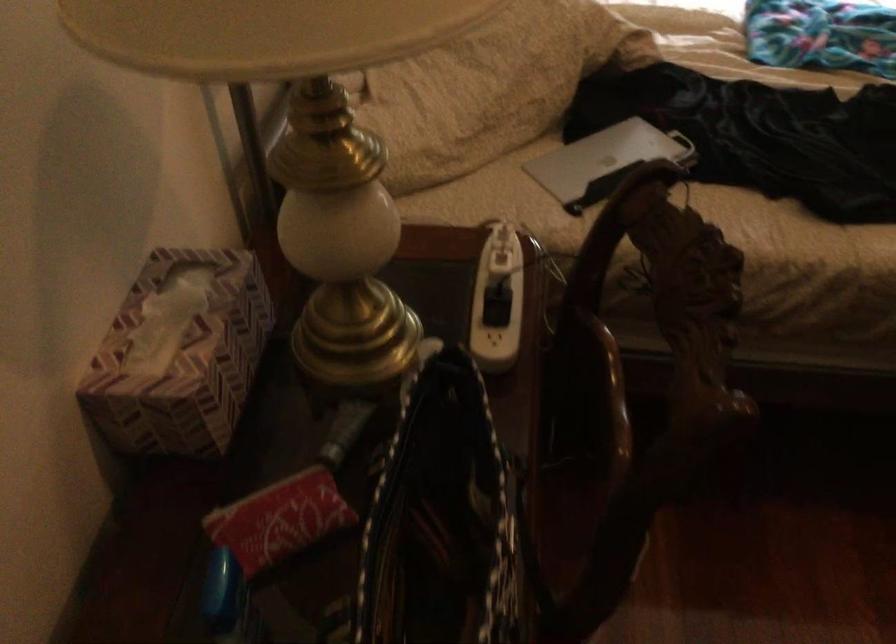
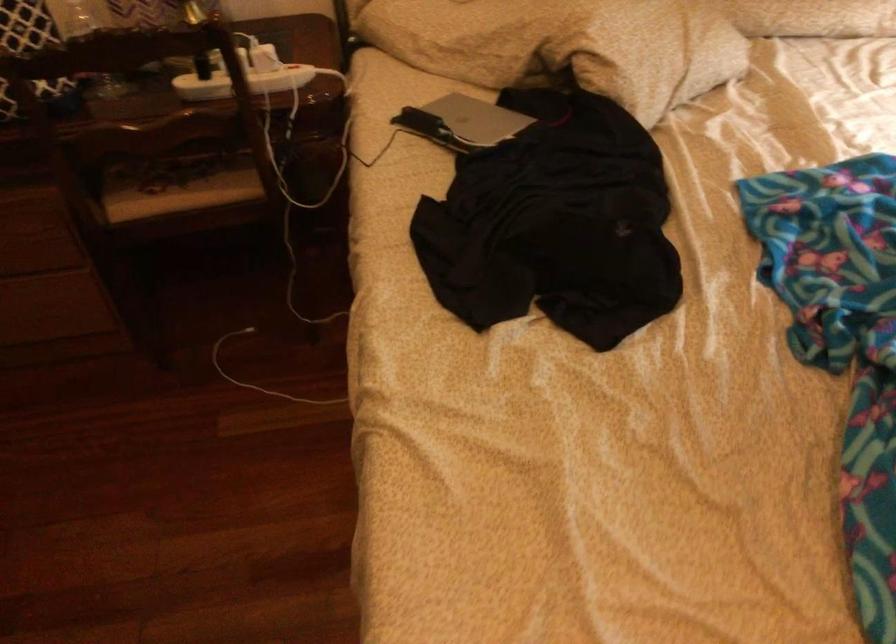
Where in the second image is the point corresponding to (x=593, y=263) from the first image?

(243, 82)